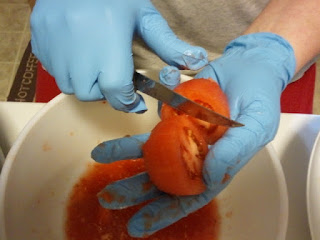
The width and height of the screenshot is (320, 240). I want to click on rug, so click(x=28, y=79).